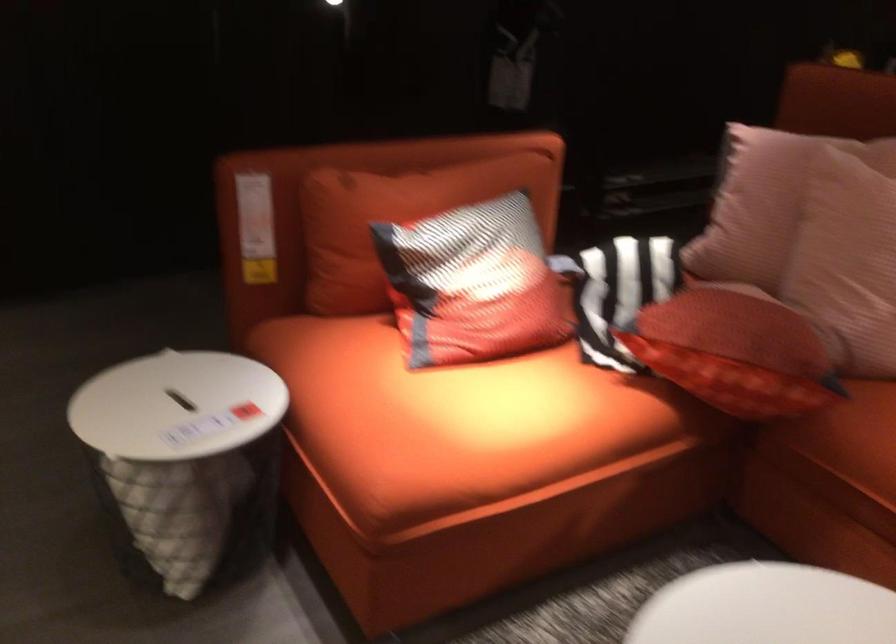
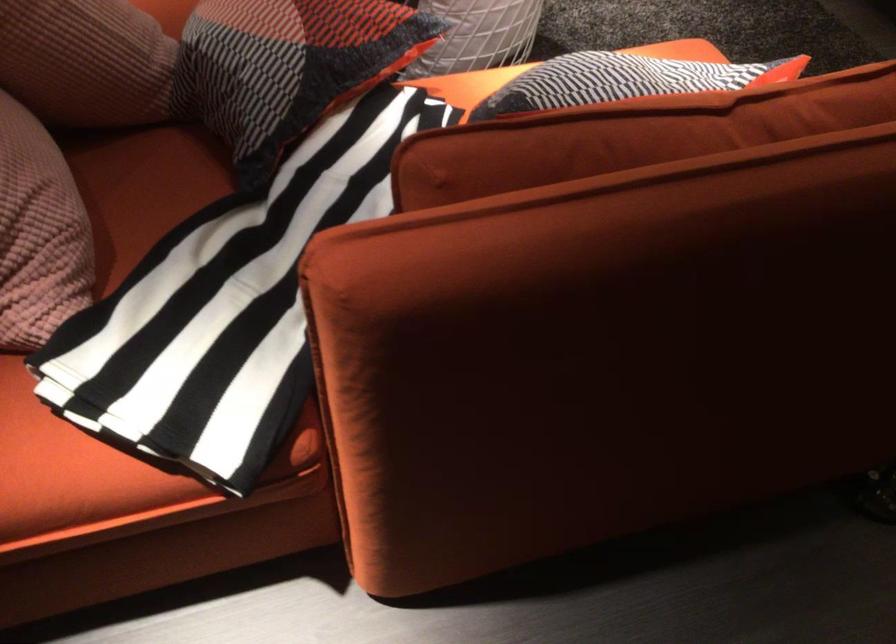
Where in the second image is the point corresponding to point 785,260 from the first image?

(85, 61)